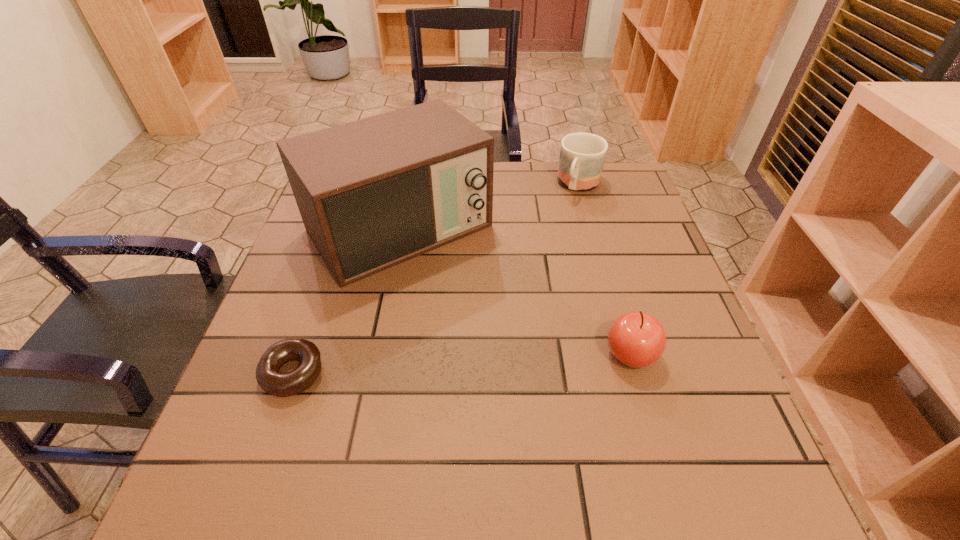
Identify the location of vacant spot on the desktop that is between the shortest object and the apple and is positioned on the front-facing side of the tallest object. This screenshot has height=540, width=960. (510, 361).

You are a GUI agent. You are given a task and a screenshot of the screen. Output one action in this format:
    pyautogui.click(x=<x>, y=<y>)
    Task: Click on the free space on the desktop that is between the shortest object and the apple and is positioned on the side with the handle of the mug
    
    Given the screenshot: What is the action you would take?
    click(x=482, y=362)